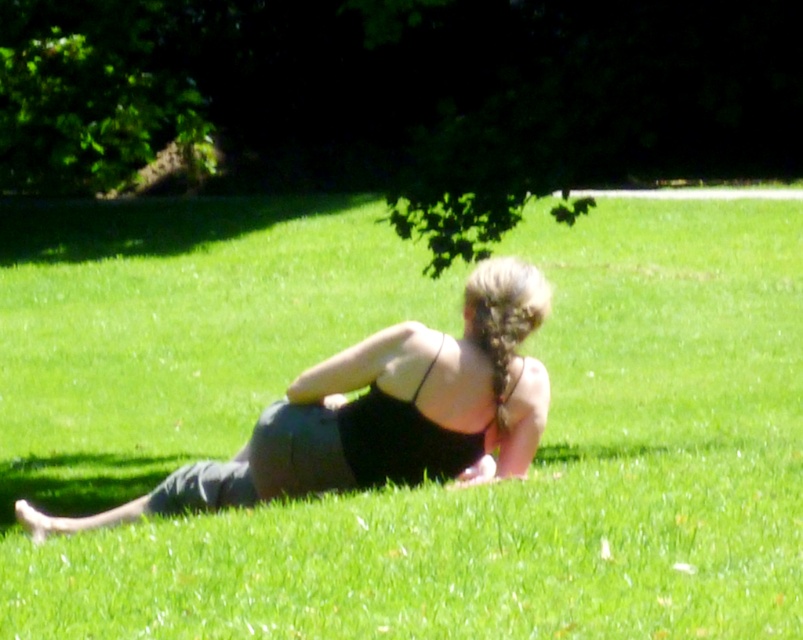
Question: Does green grassy at center come in front of black fabric tank top at center?

Choices:
 (A) no
 (B) yes

Answer: (B)

Question: Which object is positioned closest to the black matte bikini top at center?

Choices:
 (A) black fabric tank top at center
 (B) green grassy at center
 (C) green leafy tree at upper left
 (D) green leafy tree at upper center

Answer: (A)

Question: Considering the relative positions of green leafy tree at upper center and black matte bikini top at center in the image provided, where is green leafy tree at upper center located with respect to black matte bikini top at center?

Choices:
 (A) below
 (B) above

Answer: (B)

Question: Can you confirm if green grassy at center is positioned above green leafy tree at upper left?

Choices:
 (A) yes
 (B) no

Answer: (B)

Question: Among these points, which one is farthest from the camera?

Choices:
 (A) (11, 154)
 (B) (251, 449)

Answer: (A)

Question: Which point is closer to the camera?

Choices:
 (A) 35,109
 (B) 532,364
 (C) 337,422
 (D) 336,600

Answer: (D)